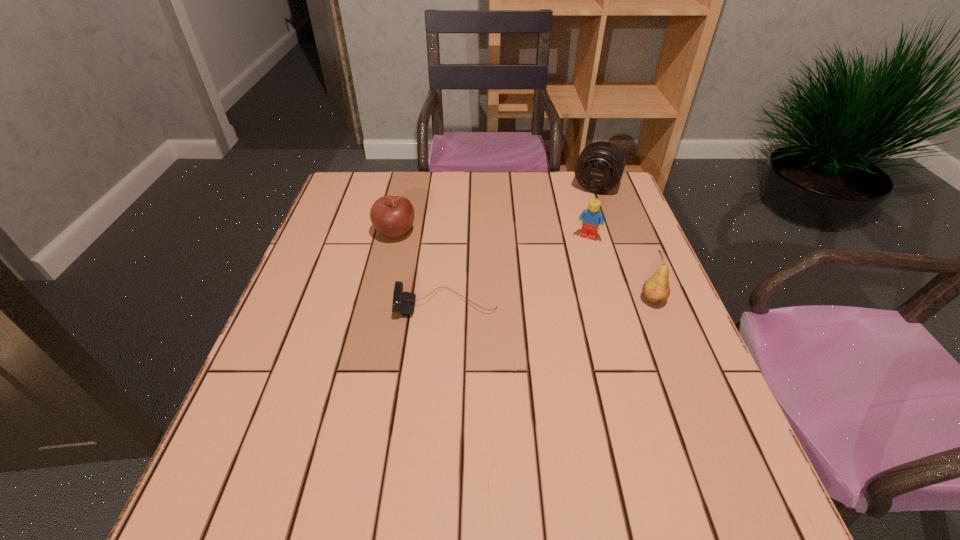
The image size is (960, 540). In the image, there is a desktop. What are the coordinates of `free space at the near right corner` in the screenshot? It's located at click(x=707, y=441).

The height and width of the screenshot is (540, 960). What are the coordinates of `vacant space that is in between the webcam and the pear` in the screenshot? It's located at [x=550, y=302].

At what (x,y) coordinates should I click in order to perform the action: click on free space that is in between the second shortest object and the telephoto lens. Please return your answer as a coordinate pair (x, y). Looking at the image, I should click on tap(495, 209).

At what (x,y) coordinates should I click in order to perform the action: click on unoccupied area between the shortest object and the apple. Please return your answer as a coordinate pair (x, y). The height and width of the screenshot is (540, 960). Looking at the image, I should click on (420, 268).

Identify the location of free space between the webcam and the Lego. pos(516,271).

At what (x,y) coordinates should I click in order to perform the action: click on empty location between the pear and the telephoto lens. Please return your answer as a coordinate pair (x, y). This screenshot has width=960, height=540. Looking at the image, I should click on (624, 243).

In order to click on empty location between the webcam and the pear in this screenshot , I will do `click(550, 302)`.

Locate an element on the screen. The width and height of the screenshot is (960, 540). empty space that is in between the pear and the shortest object is located at coordinates pyautogui.click(x=550, y=302).

The image size is (960, 540). Identify the location of vacant space that's between the Lego and the pear. (620, 269).

The height and width of the screenshot is (540, 960). In order to click on vacant area between the apple and the farthest object in this screenshot , I will do `click(495, 209)`.